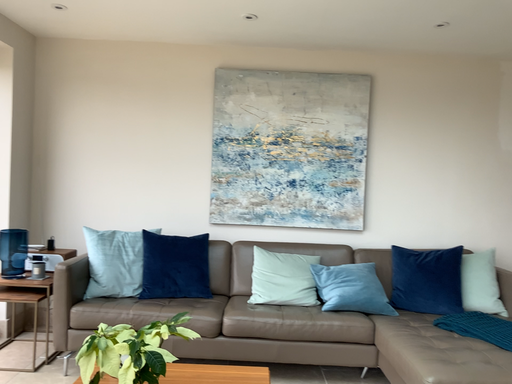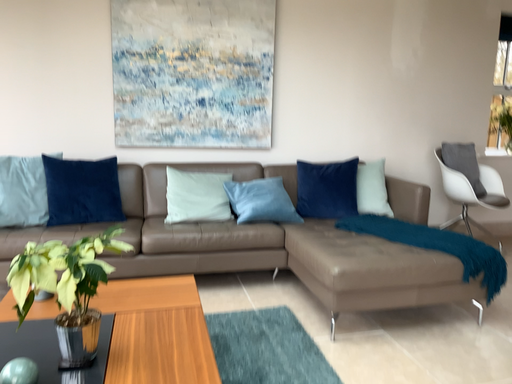
Question: How did the camera likely rotate when shooting the video?

Choices:
 (A) rotated upward
 (B) rotated downward

Answer: (B)